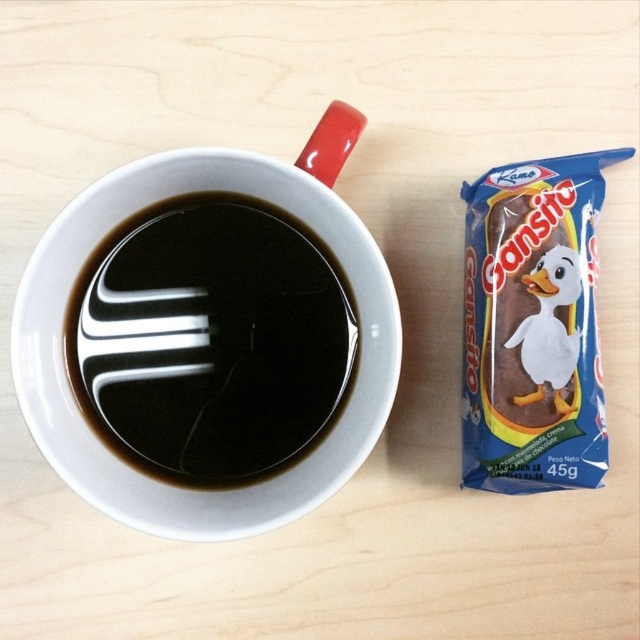
Does point (264, 429) lie behind point (536, 179)?

No, it is not.

Is black glossy coffee cup at upper left below brown chocolate wafer at right?

Correct, black glossy coffee cup at upper left is located below brown chocolate wafer at right.

Is point (333, 314) less distant than point (493, 472)?

Yes, it is.

Where is `black glossy coffee cup at upper left`? black glossy coffee cup at upper left is located at coordinates [212, 340].